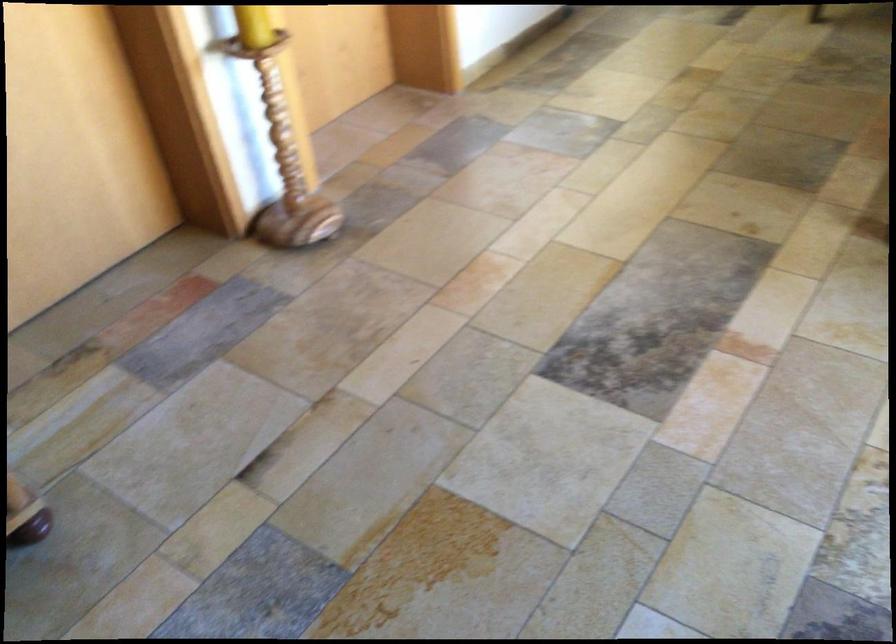
Which object does [283,162] point to?

This point indicates the wooden candlestick holder.